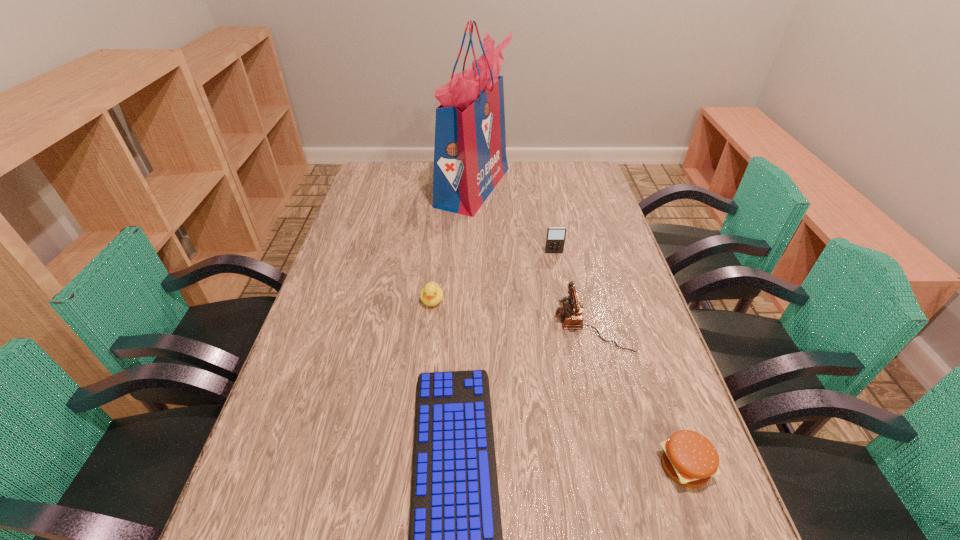
Image resolution: width=960 pixels, height=540 pixels. I want to click on unoccupied position between the hamburger and the telephone, so click(x=638, y=395).

At what (x,y) coordinates should I click in order to perform the action: click on empty location between the second farthest object and the tallest object. Please return your answer as a coordinate pair (x, y). The height and width of the screenshot is (540, 960). Looking at the image, I should click on (514, 220).

Where is `vacant space in between the second farthest object and the duckling`? vacant space in between the second farthest object and the duckling is located at coordinates (493, 276).

Identify the location of empty location between the iPod and the farthest object. The width and height of the screenshot is (960, 540). (514, 220).

Where is `unoccupied position between the hamburger and the telephone`? This screenshot has width=960, height=540. unoccupied position between the hamburger and the telephone is located at coordinates (638, 395).

Locate which object ranks fourth in proximity to the telephone. Please provide its 2D coordinates. Your answer should be formatted as a tuple, i.e. [(x, y)], where the tuple contains the x and y coordinates of a point satisfying the conditions above.

[(431, 294)]

Select which object is the closest to the farthest object. Please provide its 2D coordinates. Your answer should be formatted as a tuple, i.e. [(x, y)], where the tuple contains the x and y coordinates of a point satisfying the conditions above.

[(555, 239)]

At what (x,y) coordinates should I click in order to perform the action: click on vacant area in the image that satisfies the following two spatial constraints: 1. on the front-facing side of the tallest object; 2. on the beak of the duckling. Please return your answer as a coordinate pair (x, y). Looking at the image, I should click on (470, 301).

The width and height of the screenshot is (960, 540). I want to click on vacant position in the image that satisfies the following two spatial constraints: 1. on the front-facing side of the second farthest object; 2. on the left side of the hamburger, so click(596, 466).

You are a GUI agent. You are given a task and a screenshot of the screen. Output one action in this format:
    pyautogui.click(x=<x>, y=<y>)
    Task: Click on the free space that satisfies the following two spatial constraints: 1. on the beak of the hamburger; 2. on the left side of the duckling
    The height and width of the screenshot is (540, 960).
    Given the screenshot: What is the action you would take?
    pyautogui.click(x=414, y=466)